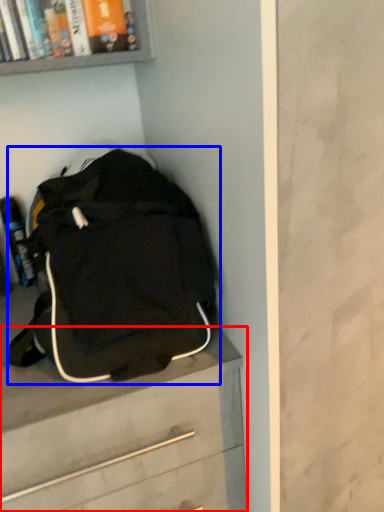
Question: Which object is closer to the camera taking this photo, chest of drawers (highlighted by a red box) or backpack (highlighted by a blue box)?

Choices:
 (A) chest of drawers
 (B) backpack

Answer: (B)